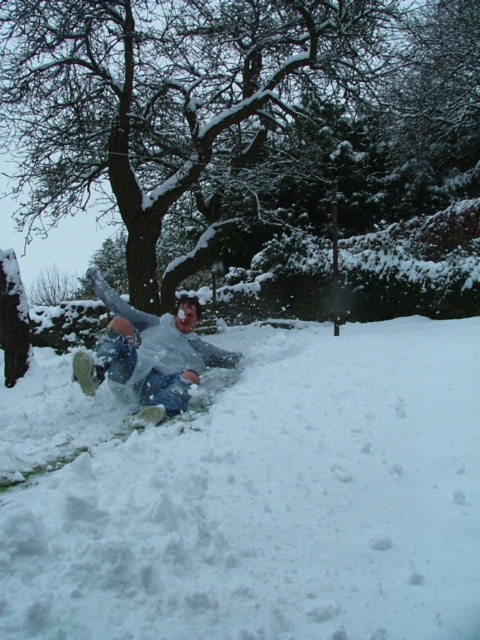
Question: Does white fluffy snow at center have a larger size compared to snow-covered tree at upper left?

Choices:
 (A) yes
 (B) no

Answer: (B)

Question: Estimate the real-world distances between objects in this image. Which object is closer to the white matte snowboarder at center?

Choices:
 (A) white fluffy snow at center
 (B) snow-covered tree at upper left

Answer: (A)

Question: Can you confirm if snow-covered tree at upper left is positioned to the left of white matte snowboarder at center?

Choices:
 (A) no
 (B) yes

Answer: (B)

Question: Which point is farther to the camera?

Choices:
 (A) (139, 376)
 (B) (165, 548)

Answer: (A)

Question: Can you confirm if white fluffy snow at center is positioned below white matte snowboarder at center?

Choices:
 (A) no
 (B) yes

Answer: (B)

Question: Which of these objects is positioned farthest from the snow-covered tree at upper left?

Choices:
 (A) white fluffy snow at center
 (B) white matte snowboarder at center

Answer: (A)